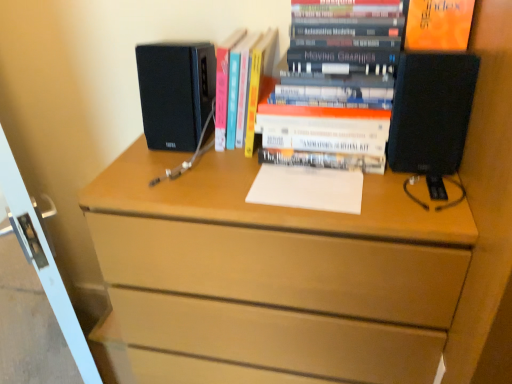
Question: Considering the relative sizes of hardcover books at center, marked as the first book in a right-to-left arrangement, and orange matte paper at upper right in the image provided, is hardcover books at center, marked as the first book in a right-to-left arrangement, bigger than orange matte paper at upper right?

Choices:
 (A) no
 (B) yes

Answer: (B)

Question: Is hardcover books at center, which appears as the 2th book when viewed from the left, next to orange matte paper at upper right?

Choices:
 (A) yes
 (B) no

Answer: (B)

Question: From a real-world perspective, is hardcover books at center, which appears as the 2th book when viewed from the left, physically above orange matte paper at upper right?

Choices:
 (A) yes
 (B) no

Answer: (B)

Question: Could you tell me if hardcover books at center, which appears as the 2th book when viewed from the left, is turned towards orange matte paper at upper right?

Choices:
 (A) yes
 (B) no

Answer: (B)

Question: From a real-world perspective, is hardcover books at center, marked as the first book in a right-to-left arrangement, under orange matte paper at upper right?

Choices:
 (A) no
 (B) yes

Answer: (B)

Question: Would you say hardcover book at center, which appears as the first book when viewed from the left, is to the left or to the right of black matte speaker at right, the 2th desktop computer in the left-to-right sequence, in the picture?

Choices:
 (A) left
 (B) right

Answer: (A)

Question: In terms of width, does hardcover book at center, the 2th book positioned from the right, look wider or thinner when compared to black matte speaker at right, the 2th desktop computer in the left-to-right sequence?

Choices:
 (A) thin
 (B) wide

Answer: (B)

Question: In the image, is hardcover book at center, the 2th book positioned from the right, positioned in front of or behind black matte speaker at right, which ranks as the first desktop computer in right-to-left order?

Choices:
 (A) behind
 (B) front

Answer: (A)

Question: Is hardcover book at center, the 2th book positioned from the right, inside the boundaries of black matte speaker at right, which ranks as the first desktop computer in right-to-left order, or outside?

Choices:
 (A) outside
 (B) inside

Answer: (A)

Question: In the image, is black matte speaker at upper left, the first desktop computer positioned from the left, on the left side or the right side of orange matte paper at upper right?

Choices:
 (A) left
 (B) right

Answer: (A)

Question: In terms of width, does black matte speaker at upper left, the first desktop computer positioned from the left, look wider or thinner when compared to orange matte paper at upper right?

Choices:
 (A) wide
 (B) thin

Answer: (A)

Question: Does point (160, 135) appear closer or farther from the camera than point (411, 41)?

Choices:
 (A) farther
 (B) closer

Answer: (A)

Question: Considering the positions of black matte speaker at upper left, which is the second desktop computer in right-to-left order, and orange matte paper at upper right in the image, is black matte speaker at upper left, which is the second desktop computer in right-to-left order, bigger or smaller than orange matte paper at upper right?

Choices:
 (A) big
 (B) small

Answer: (A)

Question: In terms of height, does black matte speaker at right, which ranks as the first desktop computer in right-to-left order, look taller or shorter compared to white glossy screen door at left?

Choices:
 (A) tall
 (B) short

Answer: (B)

Question: Relative to white glossy screen door at left, is black matte speaker at right, the 2th desktop computer in the left-to-right sequence, in front or behind?

Choices:
 (A) front
 (B) behind

Answer: (B)